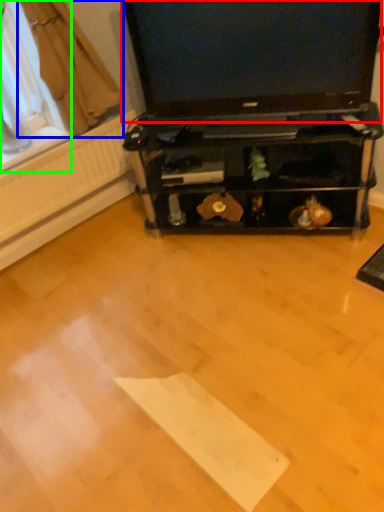
Question: Based on their relative distances, which object is farther from television (highlighted by a red box)? Choose from curtain (highlighted by a blue box) and window screen (highlighted by a green box).

Choices:
 (A) curtain
 (B) window screen

Answer: (B)